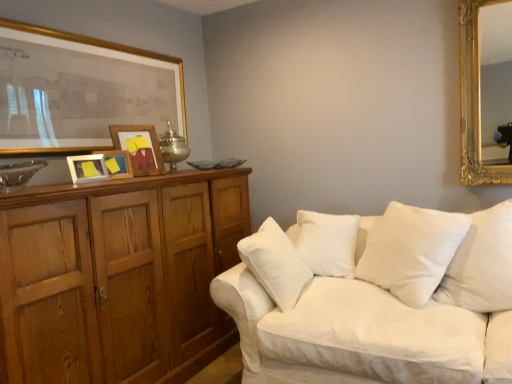
Image resolution: width=512 pixels, height=384 pixels. What do you see at coordinates (87, 168) in the screenshot? I see `matte white picture frame at upper left, acting as the 3th picture frame starting from the back` at bounding box center [87, 168].

The width and height of the screenshot is (512, 384). Describe the element at coordinates (139, 148) in the screenshot. I see `wooden picture frame at left, which appears as the first picture frame when viewed from the back` at that location.

Where is `white fabric couch at lower right`? The height and width of the screenshot is (384, 512). white fabric couch at lower right is located at coordinates (376, 298).

What do you see at coordinates (411, 251) in the screenshot?
I see `white soft cushion at center, which is the 1th pillow in right-to-left order` at bounding box center [411, 251].

You are a GUI agent. You are given a task and a screenshot of the screen. Output one action in this format:
    pyautogui.click(x=<x>, y=<y>)
    Task: Click on the wooden cabinet at left
    
    Given the screenshot: What is the action you would take?
    pyautogui.click(x=118, y=277)

From a real-world perspective, between wooden picture frame at left, placed as the 2th picture frame when sorted from back to front, and white soft cushion at center, marked as the second pillow in a left-to-right arrangement, who is vertically lower?

white soft cushion at center, marked as the second pillow in a left-to-right arrangement.

Where is `the 2nd pillow to the right when counting from the wooden picture frame at left, the third picture frame in the front-to-back sequence`? The height and width of the screenshot is (384, 512). the 2nd pillow to the right when counting from the wooden picture frame at left, the third picture frame in the front-to-back sequence is located at coordinates (411, 251).

Measure the distance from wooden picture frame at left, the third picture frame in the front-to-back sequence, to white soft cushion at center, marked as the second pillow in a left-to-right arrangement.

4.88 feet.

From the image's perspective, which is above, wooden picture frame at left, placed as the 2th picture frame when sorted from back to front, or white soft cushion at center, which is the 1th pillow in right-to-left order?

wooden picture frame at left, placed as the 2th picture frame when sorted from back to front, is shown above in the image.

Which of these two, wooden picture frame at left, placed as the fourth picture frame when sorted from front to back, or matte white picture frame at upper left, marked as the 2th picture frame in a front-to-back arrangement, is wider?

Wider between the two is wooden picture frame at left, placed as the fourth picture frame when sorted from front to back.

In the image, is wooden picture frame at left, placed as the fourth picture frame when sorted from front to back, positioned in front of or behind matte white picture frame at upper left, marked as the 2th picture frame in a front-to-back arrangement?

wooden picture frame at left, placed as the fourth picture frame when sorted from front to back, is positioned farther from the viewer than matte white picture frame at upper left, marked as the 2th picture frame in a front-to-back arrangement.

Considering the points (140, 147) and (92, 166), which point is behind, point (140, 147) or point (92, 166)?

Point (140, 147)

Which is correct: wooden picture frame at left, placed as the fourth picture frame when sorted from front to back, is inside matte white picture frame at upper left, acting as the 3th picture frame starting from the back, or outside of it?

wooden picture frame at left, placed as the fourth picture frame when sorted from front to back, is located beyond the bounds of matte white picture frame at upper left, acting as the 3th picture frame starting from the back.

From their relative heights in the image, would you say wooden picture frame at left, which appears as the first picture frame when viewed from the back, is taller or shorter than wooden cabinet at left?

In the image, wooden picture frame at left, which appears as the first picture frame when viewed from the back, appears to be shorter than wooden cabinet at left.

Would you say wooden picture frame at left, placed as the fourth picture frame when sorted from front to back, is outside wooden cabinet at left?

Absolutely, wooden picture frame at left, placed as the fourth picture frame when sorted from front to back, is external to wooden cabinet at left.

Does wooden picture frame at left, which appears as the first picture frame when viewed from the back, lie behind wooden cabinet at left?

Yes, wooden picture frame at left, which appears as the first picture frame when viewed from the back, is further from the camera.

What's the angular difference between wooden picture frame at left, placed as the fourth picture frame when sorted from front to back, and wooden cabinet at left's facing directions?

The angle between the facing direction of wooden picture frame at left, placed as the fourth picture frame when sorted from front to back, and the facing direction of wooden cabinet at left is 19.8 degrees.

Is white soft cushion at center, which is the 1th pillow in right-to-left order, surrounding wooden picture frame at left, placed as the 2th picture frame when sorted from back to front?

That's incorrect, wooden picture frame at left, placed as the 2th picture frame when sorted from back to front, is not inside white soft cushion at center, which is the 1th pillow in right-to-left order.

From their relative heights in the image, would you say white soft cushion at center, which is the 1th pillow in right-to-left order, is taller or shorter than wooden picture frame at left, the third picture frame in the front-to-back sequence?

Considering their sizes, white soft cushion at center, which is the 1th pillow in right-to-left order, has more height than wooden picture frame at left, the third picture frame in the front-to-back sequence.

From a real-world perspective, is white soft cushion at center, marked as the second pillow in a left-to-right arrangement, above or below wooden picture frame at left, placed as the 2th picture frame when sorted from back to front?

From a real-world perspective, white soft cushion at center, marked as the second pillow in a left-to-right arrangement, is physically below wooden picture frame at left, placed as the 2th picture frame when sorted from back to front.

Is white soft cushion at center, which is the 1th pillow in right-to-left order, to the right of wooden picture frame at left, the third picture frame in the front-to-back sequence, from the viewer's perspective?

Correct, you'll find white soft cushion at center, which is the 1th pillow in right-to-left order, to the right of wooden picture frame at left, the third picture frame in the front-to-back sequence.

Image resolution: width=512 pixels, height=384 pixels. In order to click on pillow that is the 2nd object directly below the matte white picture frame at upper left, marked as the 2th picture frame in a front-to-back arrangement (from a real-world perspective) in this screenshot , I will do `click(327, 242)`.

How different are the orientations of matte white picture frame at upper left, marked as the 2th picture frame in a front-to-back arrangement, and white soft cushion at center, the 2th pillow positioned from the right, in degrees?

There is a 58.1-degree angle between the facing directions of matte white picture frame at upper left, marked as the 2th picture frame in a front-to-back arrangement, and white soft cushion at center, the 2th pillow positioned from the right.

Does matte white picture frame at upper left, acting as the 3th picture frame starting from the back, come in front of white soft cushion at center, which is counted as the 1th pillow, starting from the left?

Yes, it is in front of white soft cushion at center, which is counted as the 1th pillow, starting from the left.

Considering the positions of point (94, 172) and point (347, 263), is point (94, 172) closer or farther from the camera than point (347, 263)?

Clearly, point (94, 172) is closer to the camera than point (347, 263).

Is wooden picture frame at left, the third picture frame in the front-to-back sequence, completely or partially inside gold-framed picture at upper left, which appears as the first picture frame when viewed from the front?

Actually, wooden picture frame at left, the third picture frame in the front-to-back sequence, is outside gold-framed picture at upper left, which appears as the first picture frame when viewed from the front.

Are gold-framed picture at upper left, which appears as the first picture frame when viewed from the front, and wooden picture frame at left, placed as the 2th picture frame when sorted from back to front, beside each other?

No, gold-framed picture at upper left, which appears as the first picture frame when viewed from the front, is not with wooden picture frame at left, placed as the 2th picture frame when sorted from back to front.

Measure the distance between gold-framed picture at upper left, which appears as the first picture frame when viewed from the front, and wooden picture frame at left, the third picture frame in the front-to-back sequence.

gold-framed picture at upper left, which appears as the first picture frame when viewed from the front, and wooden picture frame at left, the third picture frame in the front-to-back sequence, are 18.20 inches apart from each other.

From the image's perspective, does gold-framed picture at upper left, the fourth picture frame positioned from the back, appear higher than wooden picture frame at left, placed as the 2th picture frame when sorted from back to front?

Yes, from the image's perspective, gold-framed picture at upper left, the fourth picture frame positioned from the back, is above wooden picture frame at left, placed as the 2th picture frame when sorted from back to front.

In the scene shown: Is gold-framed picture at upper left, which appears as the first picture frame when viewed from the front, located within white soft cushion at center, marked as the second pillow in a left-to-right arrangement?

No.

Considering the sizes of white soft cushion at center, which is the 1th pillow in right-to-left order, and gold-framed picture at upper left, the fourth picture frame positioned from the back, in the image, is white soft cushion at center, which is the 1th pillow in right-to-left order, taller or shorter than gold-framed picture at upper left, the fourth picture frame positioned from the back,?

Considering their sizes, white soft cushion at center, which is the 1th pillow in right-to-left order, has less height than gold-framed picture at upper left, the fourth picture frame positioned from the back.

From a real-world perspective, is white soft cushion at center, which is the 1th pillow in right-to-left order, positioned under gold-framed picture at upper left, which appears as the first picture frame when viewed from the front, based on gravity?

Yes, from a real-world perspective, white soft cushion at center, which is the 1th pillow in right-to-left order, is beneath gold-framed picture at upper left, which appears as the first picture frame when viewed from the front.

Can you tell me how much white soft cushion at center, which is the 1th pillow in right-to-left order, and gold-framed picture at upper left, which appears as the first picture frame when viewed from the front, differ in facing direction?

129 degrees.

Where is `the 2nd pillow below the wooden picture frame at left, the third picture frame in the front-to-back sequence (from the image's perspective)`? the 2nd pillow below the wooden picture frame at left, the third picture frame in the front-to-back sequence (from the image's perspective) is located at coordinates (411, 251).

The width and height of the screenshot is (512, 384). In order to click on the 2nd picture frame to the left when counting from the wooden picture frame at left, which appears as the first picture frame when viewed from the back in this screenshot , I will do `click(87, 168)`.

Considering their positions, is gold-framed picture at upper left, which appears as the first picture frame when viewed from the front, positioned closer to wooden cabinet at left than wooden picture frame at left, which appears as the first picture frame when viewed from the back?

Among the two, wooden picture frame at left, which appears as the first picture frame when viewed from the back, is located nearer to wooden cabinet at left.

Considering their positions, is white soft cushion at center, marked as the second pillow in a left-to-right arrangement, positioned further to wooden picture frame at left, which appears as the first picture frame when viewed from the back, than white fabric couch at lower right?

The object further to wooden picture frame at left, which appears as the first picture frame when viewed from the back, is white soft cushion at center, marked as the second pillow in a left-to-right arrangement.

Looking at this image, looking at the image, which one is located closer to white soft cushion at center, the 2th pillow positioned from the right, white fabric couch at lower right or wooden cabinet at left?

The object closer to white soft cushion at center, the 2th pillow positioned from the right, is white fabric couch at lower right.

In the scene shown: Considering their positions, is white soft cushion at center, the 2th pillow positioned from the right, positioned closer to wooden picture frame at left, the third picture frame in the front-to-back sequence, than white fabric couch at lower right?

white soft cushion at center, the 2th pillow positioned from the right, is closer to wooden picture frame at left, the third picture frame in the front-to-back sequence.

Estimate the real-world distances between objects in this image. Which object is closer to white soft cushion at center, which is counted as the 1th pillow, starting from the left, wooden picture frame at left, placed as the 2th picture frame when sorted from back to front, or wooden cabinet at left?

Based on the image, wooden cabinet at left appears to be nearer to white soft cushion at center, which is counted as the 1th pillow, starting from the left.

Estimate the real-world distances between objects in this image. Which object is closer to wooden cabinet at left, gold-framed picture at upper left, which appears as the first picture frame when viewed from the front, or white soft cushion at center, which is counted as the 1th pillow, starting from the left?

white soft cushion at center, which is counted as the 1th pillow, starting from the left, lies closer to wooden cabinet at left than the other object.

Based on their spatial positions, is gold-framed picture at upper left, which appears as the first picture frame when viewed from the front, or white soft cushion at center, the 2th pillow positioned from the right, closer to matte white picture frame at upper left, marked as the 2th picture frame in a front-to-back arrangement?

gold-framed picture at upper left, which appears as the first picture frame when viewed from the front.

Looking at this image, from the image, which object appears to be nearer to wooden picture frame at left, the third picture frame in the front-to-back sequence, wooden picture frame at left, which appears as the first picture frame when viewed from the back, or white fabric couch at lower right?

wooden picture frame at left, which appears as the first picture frame when viewed from the back, lies closer to wooden picture frame at left, the third picture frame in the front-to-back sequence, than the other object.

Identify the location of cabinetry situated between matte white picture frame at upper left, acting as the 3th picture frame starting from the back, and white soft cushion at center, which is the 1th pillow in right-to-left order, from left to right. The width and height of the screenshot is (512, 384). (118, 277).

I want to click on pillow between wooden picture frame at left, placed as the 2th picture frame when sorted from back to front, and white soft cushion at center, which is the 1th pillow in right-to-left order, so click(x=327, y=242).

Locate an element on the screen. The image size is (512, 384). cabinetry situated between wooden picture frame at left, the third picture frame in the front-to-back sequence, and white fabric couch at lower right from left to right is located at coordinates (118, 277).

This screenshot has height=384, width=512. I want to click on studio couch between matte white picture frame at upper left, acting as the 3th picture frame starting from the back, and white soft cushion at center, which is the 1th pillow in right-to-left order, in the horizontal direction, so point(376,298).